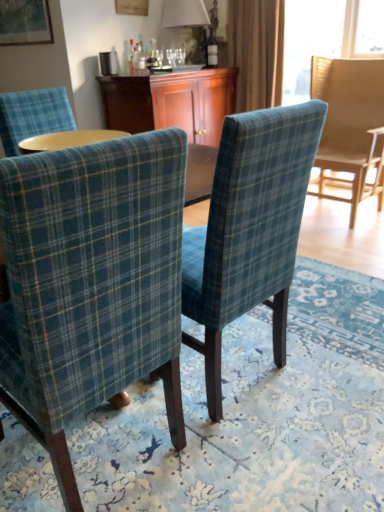
Question: Is plaid fabric chair at center, the first chair positioned from the left, further to the viewer compared to wooden cabinet at center?

Choices:
 (A) yes
 (B) no

Answer: (B)

Question: From the image's perspective, is plaid fabric chair at center, placed as the 3th chair when sorted from back to front, over wooden cabinet at center?

Choices:
 (A) no
 (B) yes

Answer: (A)

Question: Is plaid fabric chair at center, the first chair positioned from the front, shorter than wooden cabinet at center?

Choices:
 (A) yes
 (B) no

Answer: (B)

Question: Could you tell me if plaid fabric chair at center, the first chair positioned from the front, is turned towards wooden cabinet at center?

Choices:
 (A) yes
 (B) no

Answer: (B)

Question: Does plaid fabric chair at center, placed as the 3th chair when sorted from back to front, have a greater width compared to wooden cabinet at center?

Choices:
 (A) no
 (B) yes

Answer: (A)

Question: Relative to blue plaid fabric chair at center, which is counted as the second chair, starting from the front, is matte white lampshade at upper center in front or behind?

Choices:
 (A) front
 (B) behind

Answer: (B)

Question: Considering the positions of matte white lampshade at upper center and blue plaid fabric chair at center, the 2th chair in the back-to-front sequence, in the image, is matte white lampshade at upper center wider or thinner than blue plaid fabric chair at center, the 2th chair in the back-to-front sequence,?

Choices:
 (A) wide
 (B) thin

Answer: (B)

Question: Which is correct: matte white lampshade at upper center is inside blue plaid fabric chair at center, the 2th chair in the back-to-front sequence, or outside of it?

Choices:
 (A) inside
 (B) outside

Answer: (B)

Question: Is point (193, 0) closer or farther from the camera than point (218, 389)?

Choices:
 (A) closer
 (B) farther

Answer: (B)

Question: Relative to plaid fabric chair at center, the first chair positioned from the left, is blue plaid fabric chair at center, which is counted as the second chair, starting from the front, in front or behind?

Choices:
 (A) behind
 (B) front

Answer: (A)

Question: Is blue plaid fabric chair at center, which is counted as the second chair, starting from the right, bigger or smaller than plaid fabric chair at center, the 3th chair when ordered from right to left?

Choices:
 (A) small
 (B) big

Answer: (A)

Question: From a real-world perspective, is blue plaid fabric chair at center, which is counted as the second chair, starting from the front, positioned above or below plaid fabric chair at center, placed as the 3th chair when sorted from back to front?

Choices:
 (A) above
 (B) below

Answer: (A)

Question: Looking at their shapes, would you say blue plaid fabric chair at center, which is counted as the second chair, starting from the right, is wider or thinner than plaid fabric chair at center, the 3th chair when ordered from right to left?

Choices:
 (A) thin
 (B) wide

Answer: (A)

Question: From a real-world perspective, is wooden cabinet at center above or below blue plaid fabric chair at center, which is counted as the second chair, starting from the right?

Choices:
 (A) above
 (B) below

Answer: (A)

Question: Considering the positions of wooden cabinet at center and blue plaid fabric chair at center, which is counted as the second chair, starting from the front, in the image, is wooden cabinet at center bigger or smaller than blue plaid fabric chair at center, which is counted as the second chair, starting from the front,?

Choices:
 (A) big
 (B) small

Answer: (A)